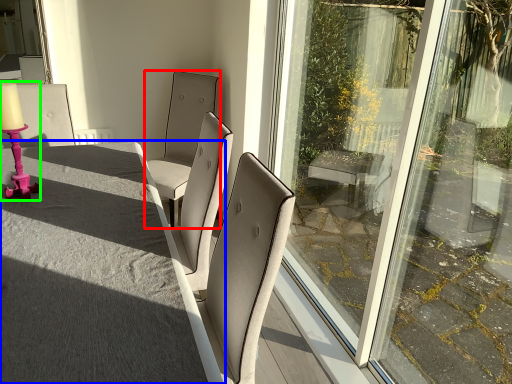
Question: Based on their relative distances, which object is nearer to chair (highlighted by a red box)? Choose from table (highlighted by a blue box) and candle holder (highlighted by a green box).

Choices:
 (A) table
 (B) candle holder

Answer: (B)